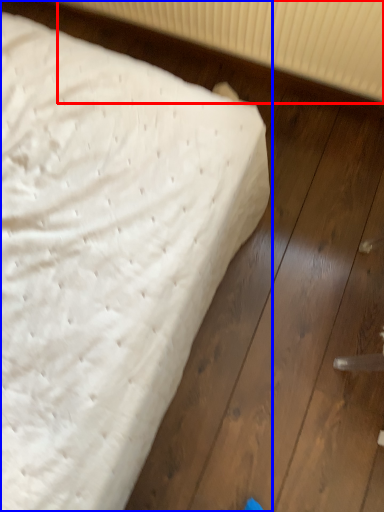
Question: Which point is further to the camera, radiator (highlighted by a red box) or bed (highlighted by a blue box)?

Choices:
 (A) radiator
 (B) bed

Answer: (A)